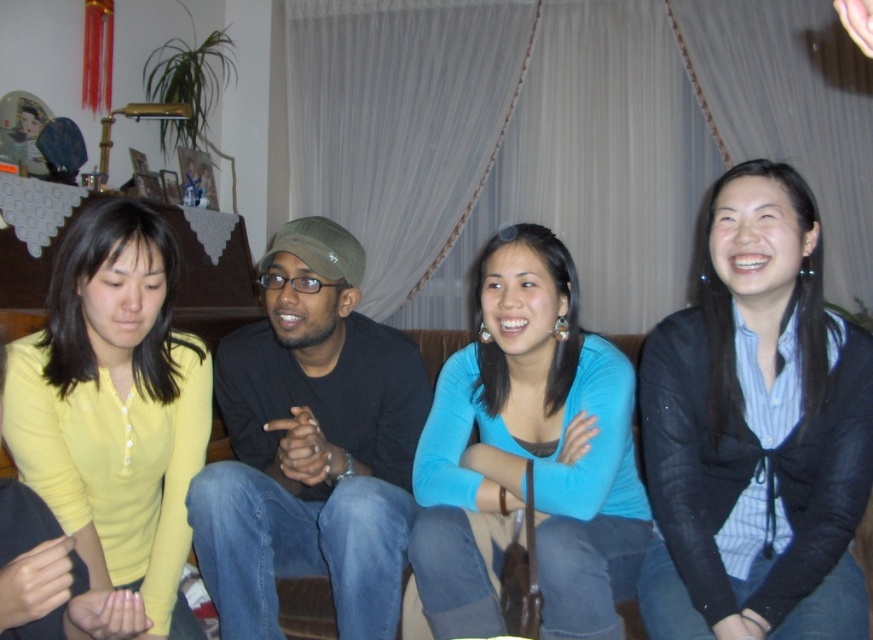
Question: Which point appears farthest from the camera in this image?

Choices:
 (A) (757, 308)
 (B) (595, 544)

Answer: (A)

Question: Which point is farther to the camera?

Choices:
 (A) (465, 422)
 (B) (373, 636)
 (C) (107, 493)
 (D) (768, 588)

Answer: (A)

Question: Is black matte shirt at center in front of yellow matte shirt at lower left?

Choices:
 (A) no
 (B) yes

Answer: (A)

Question: Which of the following is the closest to the observer?

Choices:
 (A) (304, 339)
 (B) (88, 365)

Answer: (B)

Question: Can you confirm if black matte shirt at center is bigger than yellow matte shirt at lower left?

Choices:
 (A) no
 (B) yes

Answer: (B)

Question: Can you confirm if blue matte shirt at center is bigger than yellow matte shirt at lower left?

Choices:
 (A) yes
 (B) no

Answer: (A)